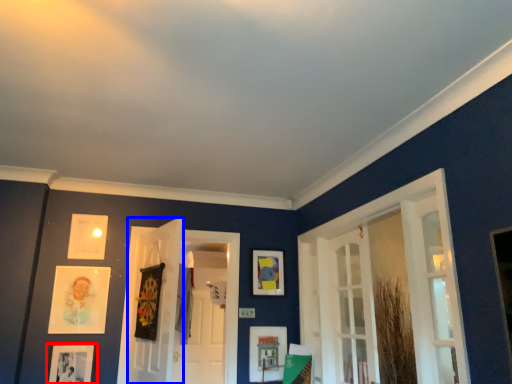
Question: Which object appears farthest to the camera in this image, picture frame (highlighted by a red box) or door (highlighted by a blue box)?

Choices:
 (A) picture frame
 (B) door

Answer: (A)